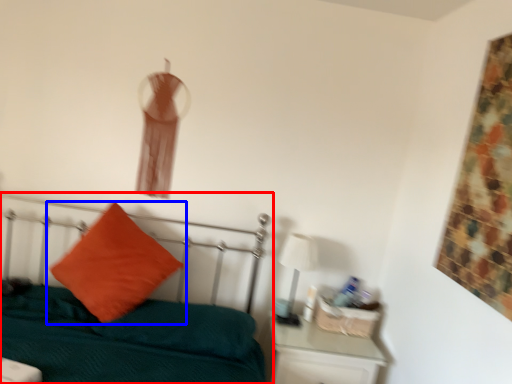
Question: Which point is closer to the camera, bed (highlighted by a red box) or pillow (highlighted by a blue box)?

Choices:
 (A) bed
 (B) pillow

Answer: (A)